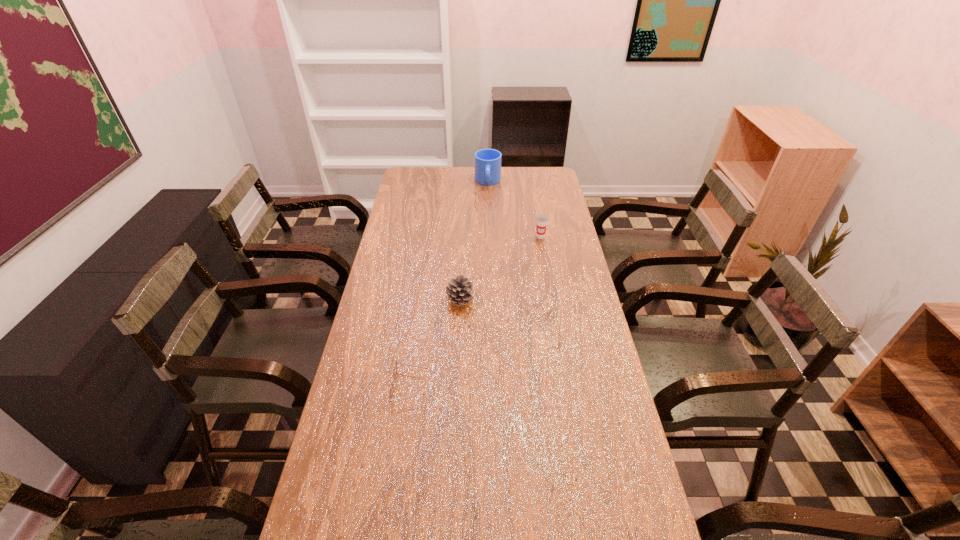
Where is `free space that is in between the mug and the cup`? The height and width of the screenshot is (540, 960). free space that is in between the mug and the cup is located at coordinates (515, 209).

Image resolution: width=960 pixels, height=540 pixels. I want to click on empty space between the pinecone and the mug, so click(474, 241).

At what (x,y) coordinates should I click in order to perform the action: click on vacant area between the second farthest object and the leftmost object. Please return your answer as a coordinate pair (x, y). The height and width of the screenshot is (540, 960). Looking at the image, I should click on (475, 312).

This screenshot has height=540, width=960. What are the coordinates of `vacant region between the cup and the nearest object` in the screenshot? It's located at (475, 312).

Find the location of a particular element. object that stands as the closest to the cup is located at coordinates (487, 161).

You are a GUI agent. You are given a task and a screenshot of the screen. Output one action in this format:
    pyautogui.click(x=<x>, y=<y>)
    Task: Click on the object that is the closest one to the nearest object
    
    Given the screenshot: What is the action you would take?
    pyautogui.click(x=459, y=289)

In order to click on free spot that satisfies the following two spatial constraints: 1. on the side of the rightmost object with the logo; 2. on the front-facing side of the nearest object in this screenshot , I will do `click(566, 387)`.

The image size is (960, 540). Identify the location of free space that satisfies the following two spatial constraints: 1. on the side of the second farthest object with the logo; 2. on the front-facing side of the leftmost object. coord(566,387).